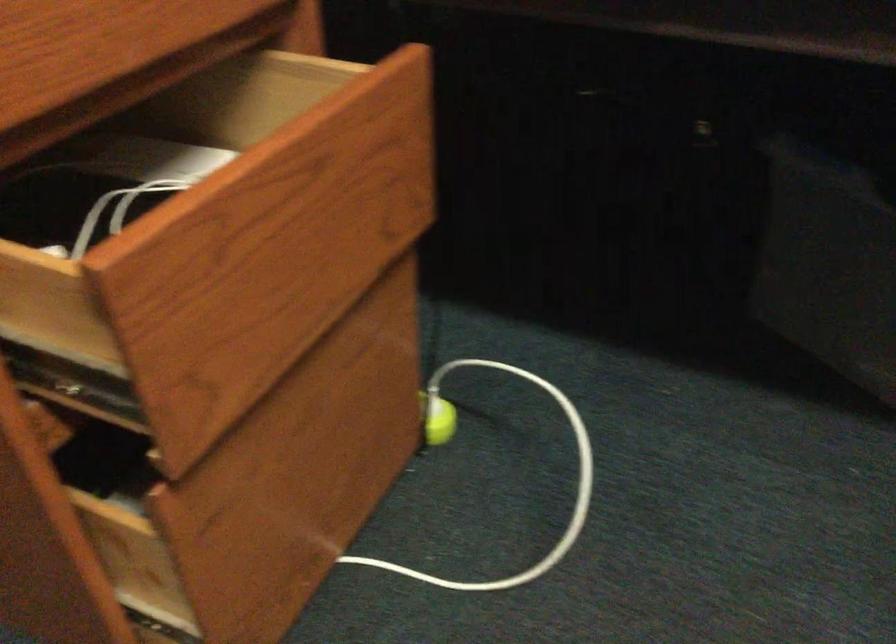
Describe the element at coordinates (35, 259) in the screenshot. I see `the open drawer edge` at that location.